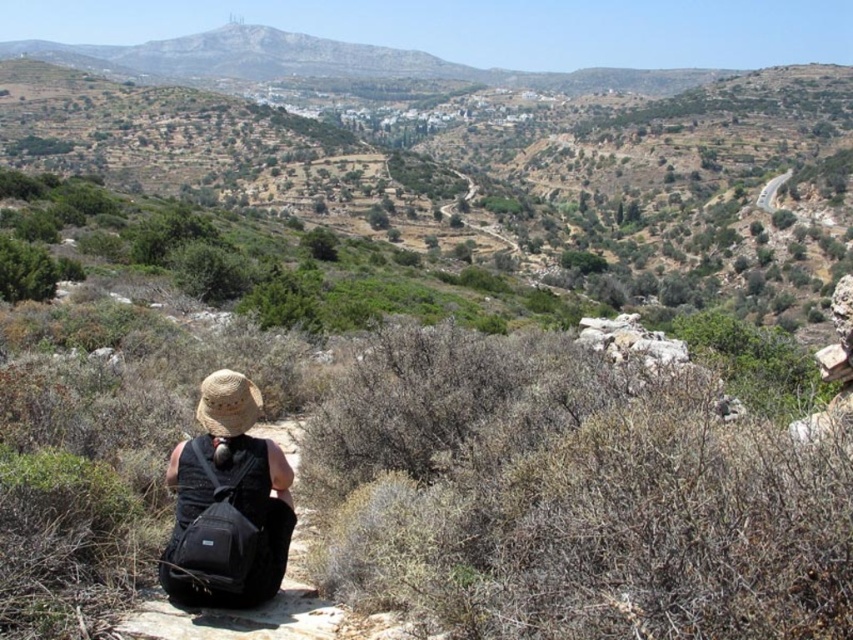
Question: Does black fabric backpack at lower left have a greater width compared to strawmaterial/texturehat at lower left?

Choices:
 (A) no
 (B) yes

Answer: (A)

Question: Is black fabric backpack at lower left wider than strawmaterial/texturehat at lower left?

Choices:
 (A) no
 (B) yes

Answer: (A)

Question: Which point appears farthest from the camera in this image?

Choices:
 (A) (270, 593)
 (B) (238, 422)

Answer: (B)

Question: Which object is farther from the camera taking this photo?

Choices:
 (A) strawmaterial/texturehat at lower left
 (B) black fabric backpack at lower left

Answer: (A)

Question: Is black fabric backpack at lower left thinner than strawmaterial/texturehat at lower left?

Choices:
 (A) yes
 (B) no

Answer: (A)